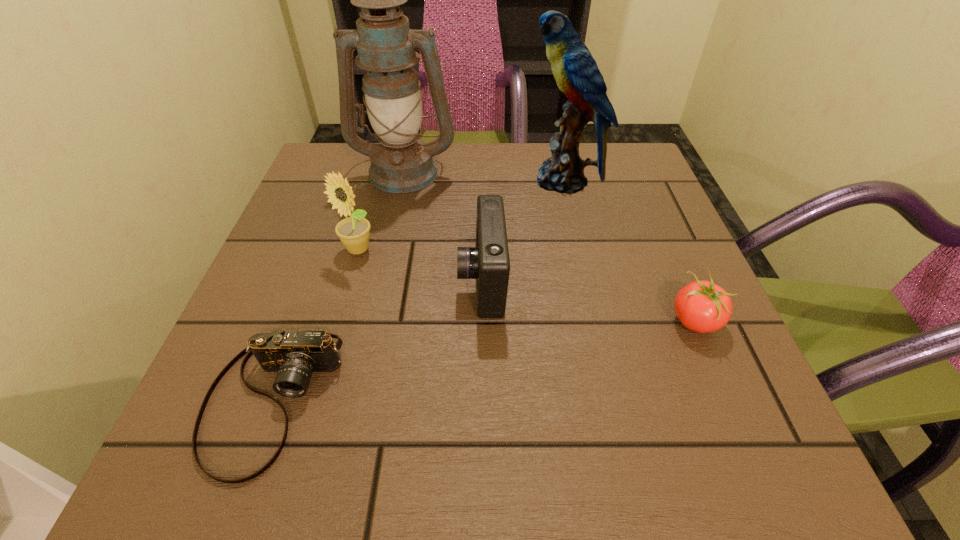
Locate an element on the screen. The height and width of the screenshot is (540, 960). object positioned at the near edge is located at coordinates (294, 355).

Identify the location of oil lamp positioned at the left edge. (401, 163).

Locate an element on the screen. The width and height of the screenshot is (960, 540). sunflower that is at the left edge is located at coordinates tap(354, 233).

This screenshot has height=540, width=960. In order to click on camera located in the left edge section of the desktop in this screenshot , I will do `click(294, 355)`.

This screenshot has height=540, width=960. What are the coordinates of `parrot that is at the right edge` in the screenshot? It's located at (576, 72).

Identify the location of tomato present at the right edge. This screenshot has height=540, width=960. (701, 306).

The height and width of the screenshot is (540, 960). In order to click on object present at the far left corner in this screenshot , I will do `click(401, 163)`.

This screenshot has height=540, width=960. Find the location of `object present at the near left corner`. object present at the near left corner is located at coordinates (294, 355).

Where is `object at the far right corner`? The image size is (960, 540). object at the far right corner is located at coordinates (576, 72).

This screenshot has height=540, width=960. Identify the location of free space at the far edge of the desktop. (467, 173).